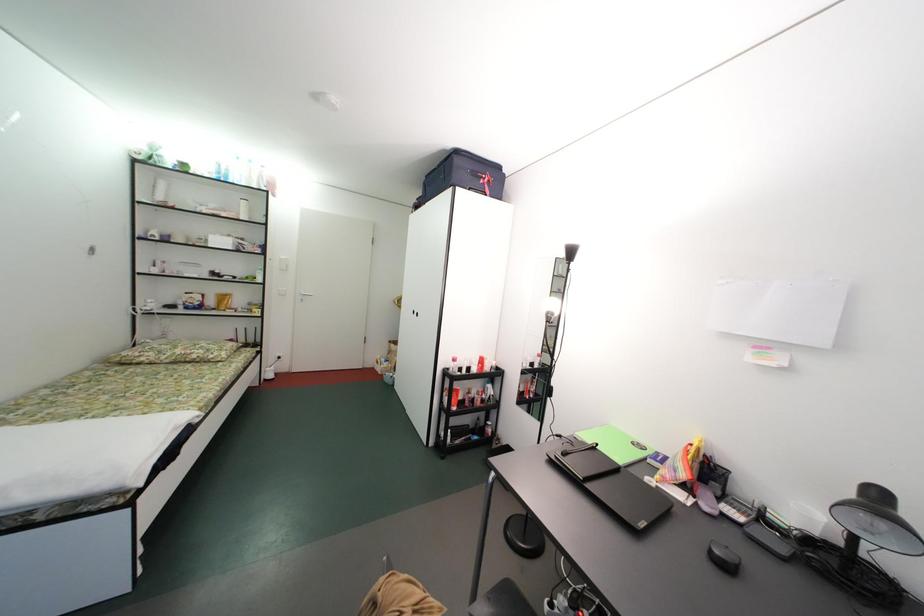
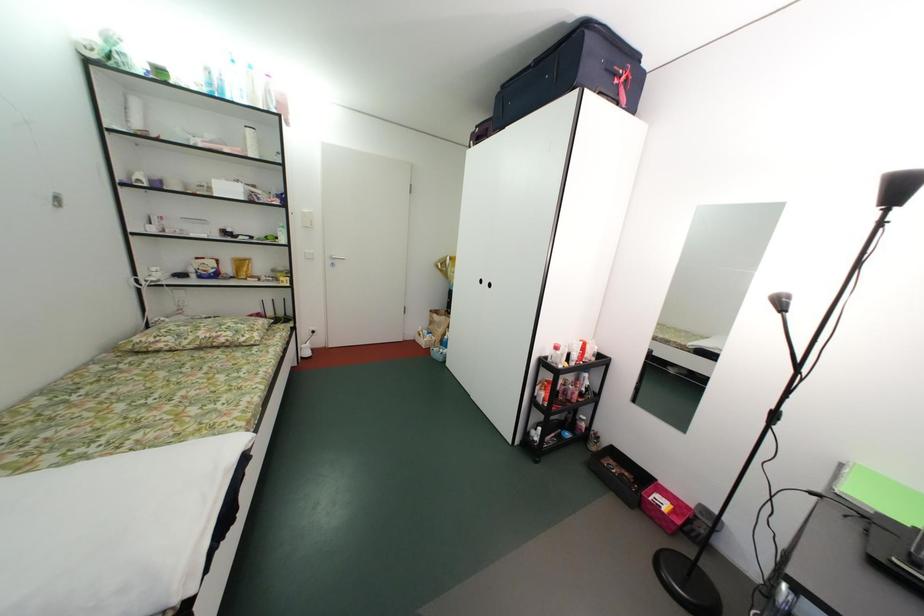
Question: The images are taken continuously from a first-person perspective. In which direction is your viewpoint rotating?

Choices:
 (A) Left
 (B) Right
 (C) Up
 (D) Down

Answer: (D)